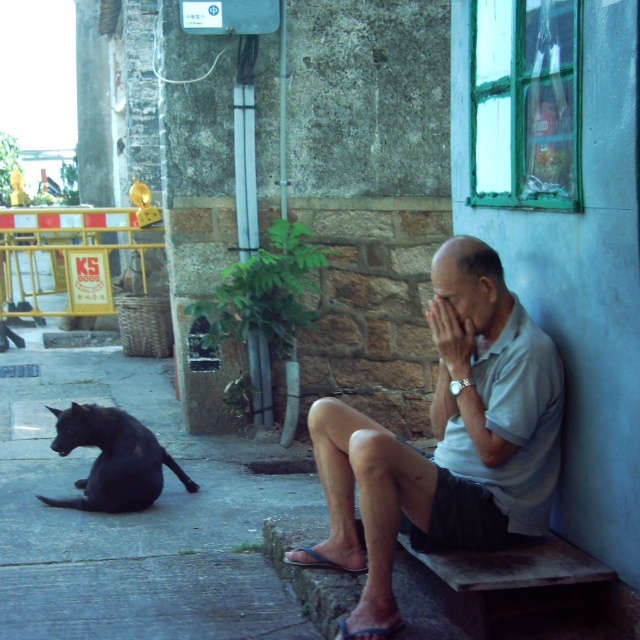
The width and height of the screenshot is (640, 640). What do you see at coordinates (132, 518) in the screenshot? I see `black smooth pavement at lower left` at bounding box center [132, 518].

Does black smooth pavement at lower left have a smaller size compared to light gray cotton shirt at center?

Indeed, black smooth pavement at lower left has a smaller size compared to light gray cotton shirt at center.

The height and width of the screenshot is (640, 640). What are the coordinates of `black smooth pavement at lower left` in the screenshot? It's located at (132, 518).

The width and height of the screenshot is (640, 640). Find the location of `black smooth pavement at lower left`. black smooth pavement at lower left is located at coordinates (132, 518).

Can you confirm if black smooth pavement at lower left is thinner than shiny black cat at lower left?

No.

Which is in front, point (188, 586) or point (140, 436)?

Positioned in front is point (188, 586).

This screenshot has width=640, height=640. Identify the location of black smooth pavement at lower left. pos(132,518).

Is light gray cotton shirt at center wider than shiny black cat at lower left?

Yes, light gray cotton shirt at center is wider than shiny black cat at lower left.

Does point (448, 403) come closer to viewer compared to point (115, 508)?

Yes, it is.

Which is in front, point (506, 500) or point (99, 429)?

Positioned in front is point (506, 500).

Where is `light gray cotton shirt at center`? light gray cotton shirt at center is located at coordinates (445, 442).